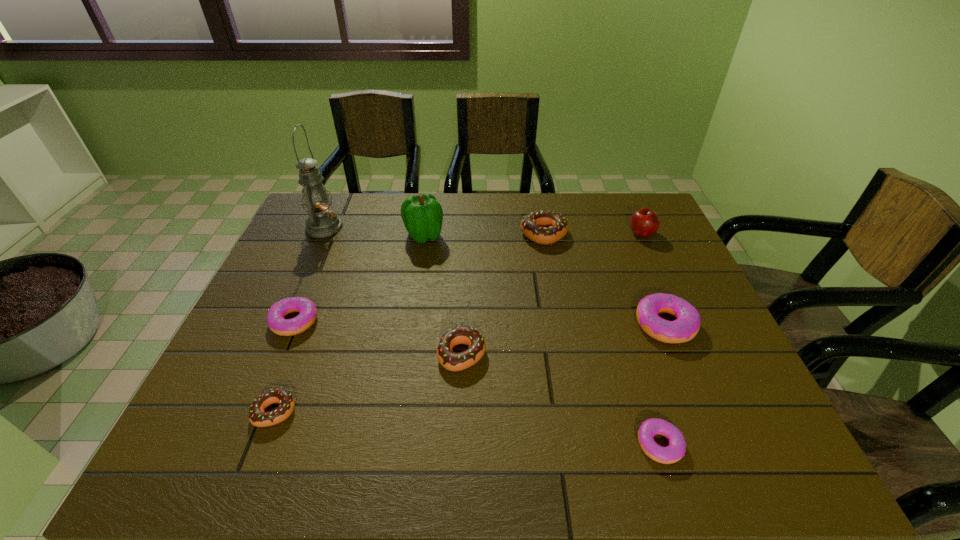
At what (x,y) coordinates should I click in order to perform the action: click on gray oil lamp. Please return your answer as a coordinate pair (x, y). Looking at the image, I should click on (322, 222).

Identify the location of the tallest object. (322, 222).

Where is `green bell pepper`? green bell pepper is located at coordinates (422, 214).

At what (x,y) coordinates should I click in order to perform the action: click on the sixth object from right to left. Please return your answer as a coordinate pair (x, y). Looking at the image, I should click on (422, 214).

Locate an element on the screen. Image resolution: width=960 pixels, height=540 pixels. the seventh shortest object is located at coordinates (644, 222).

Where is `pink apple`? The height and width of the screenshot is (540, 960). pink apple is located at coordinates click(644, 222).

This screenshot has height=540, width=960. I want to click on the farthest doughnut, so click(543, 227).

The height and width of the screenshot is (540, 960). In order to click on the sixth object from left to right in this screenshot , I will do `click(543, 227)`.

Where is `the biggest pink doughnut`? the biggest pink doughnut is located at coordinates (686, 326).

Locate an element on the screen. The height and width of the screenshot is (540, 960). the fifth object from right to left is located at coordinates (452, 361).